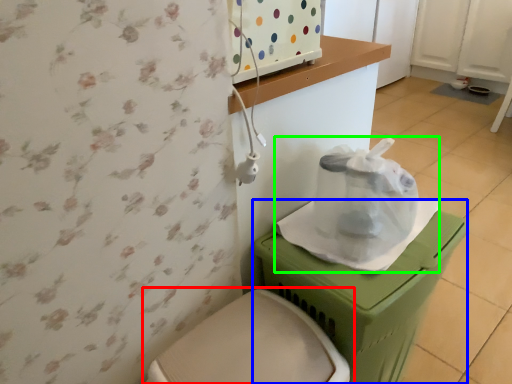
Question: Which object is positioned closest to toilet (highlighted by a red box)? Select from potty (highlighted by a blue box) and paper bag (highlighted by a green box).

Choices:
 (A) potty
 (B) paper bag

Answer: (A)